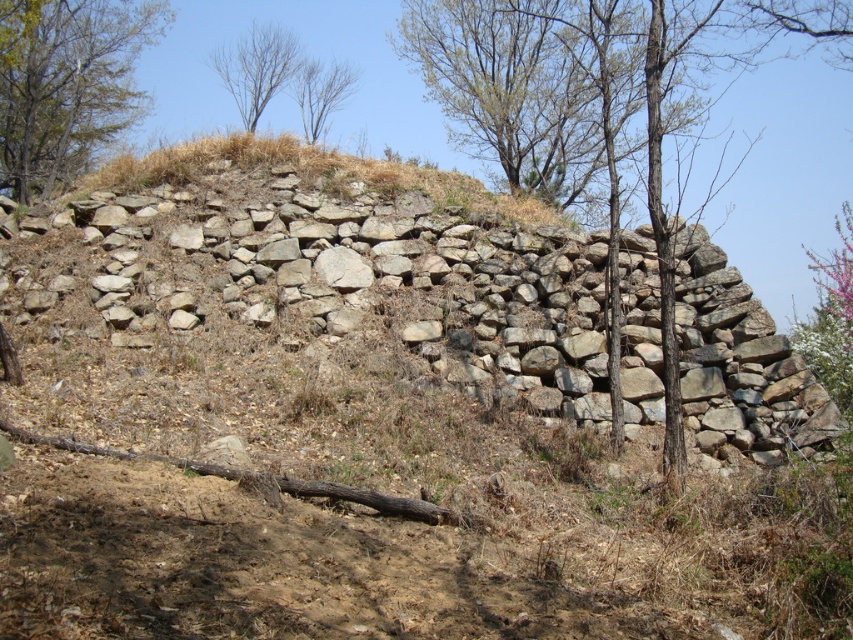
Question: Does natural stone wall at center have a lesser width compared to brown textured tree at upper left?

Choices:
 (A) no
 (B) yes

Answer: (A)

Question: Which object is the farthest from the natural stone wall at center?

Choices:
 (A) bare branches at center
 (B) bare branches at upper center

Answer: (B)

Question: Can you confirm if brown textured tree at upper left is wider than bare branches at center?

Choices:
 (A) no
 (B) yes

Answer: (A)

Question: Does brown textured tree at upper left appear on the right side of bare branches at center?

Choices:
 (A) yes
 (B) no

Answer: (B)

Question: Which is nearer to the bare wood tree at center?

Choices:
 (A) brown textured tree at upper left
 (B) natural stone wall at center

Answer: (B)

Question: Which of these objects is positioned closest to the brown textured tree at upper left?

Choices:
 (A) bare wood tree at center
 (B) bare branches at center
 (C) bare branches at upper center
 (D) natural stone wall at center

Answer: (C)